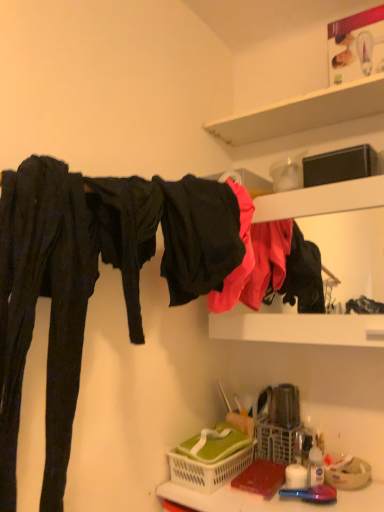
Where is `black matte fabric at upper center`? This screenshot has width=384, height=512. black matte fabric at upper center is located at coordinates (198, 236).

What do you see at coordinates (315, 467) in the screenshot? This screenshot has height=512, width=384. I see `translucent plastic bottle at lower right` at bounding box center [315, 467].

Describe the element at coordinates (293, 329) in the screenshot. Image resolution: width=384 pixels, height=512 pixels. I see `matte black clothing at upper right` at that location.

This screenshot has width=384, height=512. What do you see at coordinates (304, 113) in the screenshot? I see `white matte shelf at upper center` at bounding box center [304, 113].

Measure the distance between white matte shelf at upper center and camera.

white matte shelf at upper center is 3.45 feet away from camera.

Measure the distance between point (193, 504) and camera.

Point (193, 504) and camera are 3.45 feet apart from each other.

Locate an element on the screen. black matte fabric at upper center is located at coordinates (198, 236).

Does point (259, 446) lie behind point (319, 452)?

Yes, point (259, 446) is behind point (319, 452).

Considering the relative positions of white plastic basket at lower center, the first basket in the right-to-left sequence, and translucent plastic bottle at lower right in the image provided, is white plastic basket at lower center, the first basket in the right-to-left sequence, to the left or to the right of translucent plastic bottle at lower right?

Clearly, white plastic basket at lower center, the first basket in the right-to-left sequence, is on the left of translucent plastic bottle at lower right in the image.

Is white plastic basket at lower center, the first basket in the right-to-left sequence, outside of translucent plastic bottle at lower right?

Yes, white plastic basket at lower center, the first basket in the right-to-left sequence, is outside of translucent plastic bottle at lower right.

Can you tell me how much translucent plastic bottle at lower right and translucent plastic basket at lower center differ in facing direction?

The facing directions of translucent plastic bottle at lower right and translucent plastic basket at lower center are 35.4 degrees apart.

Which object is further away from the camera, translucent plastic bottle at lower right or translucent plastic basket at lower center?

translucent plastic bottle at lower right.

Considering the relative positions of translucent plastic bottle at lower right and translucent plastic basket at lower center in the image provided, is translucent plastic bottle at lower right to the right of translucent plastic basket at lower center from the viewer's perspective?

Correct, you'll find translucent plastic bottle at lower right to the right of translucent plastic basket at lower center.

From the picture: Is translucent plastic bottle at lower right oriented towards translucent plastic basket at lower center?

No, translucent plastic bottle at lower right is not aimed at translucent plastic basket at lower center.

From the image's perspective, is white matte shelf at upper center above or below green plastic basket at lower center, positioned as the 1th basket in left-to-right order?

Based on their image positions, white matte shelf at upper center is located above green plastic basket at lower center, positioned as the 1th basket in left-to-right order.

From the picture: Which is more to the left, white matte shelf at upper center or green plastic basket at lower center, the 2th basket positioned from the right?

From the viewer's perspective, green plastic basket at lower center, the 2th basket positioned from the right, appears more on the left side.

From the picture: Looking at their sizes, would you say white matte shelf at upper center is wider or thinner than green plastic basket at lower center, positioned as the 1th basket in left-to-right order?

white matte shelf at upper center is thinner than green plastic basket at lower center, positioned as the 1th basket in left-to-right order.

How different are the orientations of translucent plastic bottle at lower right and white matte shelf at upper center in degrees?

35.4 degrees.

From the image's perspective, is translucent plastic bottle at lower right located above or below white matte shelf at upper center?

From the image's perspective, translucent plastic bottle at lower right appears below white matte shelf at upper center.

Considering the positions of points (310, 480) and (372, 97), is point (310, 480) closer to camera compared to point (372, 97)?

Yes.

Is white matte shelf at upper center further to camera compared to translucent plastic basket at lower center?

Yes, it is behind translucent plastic basket at lower center.

Can you tell me how much white matte shelf at upper center and translucent plastic basket at lower center differ in facing direction?

The facing directions of white matte shelf at upper center and translucent plastic basket at lower center are 0.000712 degrees apart.

Is white matte shelf at upper center bigger or smaller than translucent plastic basket at lower center?

Clearly, white matte shelf at upper center is smaller in size than translucent plastic basket at lower center.

Is translucent plastic bottle at lower right touching green plastic basket at lower center, positioned as the 1th basket in left-to-right order?

They are not placed beside each other.

Which is closer, (321, 476) or (230, 463)?

Clearly, point (321, 476) is closer to the camera than point (230, 463).

From a real-world perspective, is translucent plastic bottle at lower right positioned under green plastic basket at lower center, the 2th basket positioned from the right, based on gravity?

Incorrect, from a real-world perspective, translucent plastic bottle at lower right is higher than green plastic basket at lower center, the 2th basket positioned from the right.

Is translucent plastic bottle at lower right oriented away from green plastic basket at lower center, the 2th basket positioned from the right?

translucent plastic bottle at lower right does not have its back to green plastic basket at lower center, the 2th basket positioned from the right.

Which of these two, matte black clothing at upper right or translucent plastic bottle at lower right, is thinner?

With smaller width is translucent plastic bottle at lower right.

Considering the sizes of objects matte black clothing at upper right and translucent plastic bottle at lower right in the image provided, who is smaller, matte black clothing at upper right or translucent plastic bottle at lower right?

Smaller between the two is translucent plastic bottle at lower right.

Would you say matte black clothing at upper right is inside or outside translucent plastic bottle at lower right?

matte black clothing at upper right is spatially situated outside translucent plastic bottle at lower right.

From a real-world perspective, is matte black clothing at upper right located beneath translucent plastic bottle at lower right?

No, from a real-world perspective, matte black clothing at upper right is not beneath translucent plastic bottle at lower right.

Find the location of `toiletry below the white plastic basket at lower center, the second basket when ordered from left to right (from the image's perspective)`. toiletry below the white plastic basket at lower center, the second basket when ordered from left to right (from the image's perspective) is located at coordinates (315, 467).

Find the location of a particular element. The width and height of the screenshot is (384, 512). counter top that is under the translucent plastic bottle at lower right (from a real-world perspective) is located at coordinates (268, 500).

Considering their positions, is green plastic basket at lower center, positioned as the 1th basket in left-to-right order, positioned closer to translucent plastic bottle at lower right than white matte shelf at upper center?

Based on the image, green plastic basket at lower center, positioned as the 1th basket in left-to-right order, appears to be nearer to translucent plastic bottle at lower right.

Considering their positions, is white matte shelf at upper center positioned closer to matte black clothing at upper right than white plastic basket at lower center, the second basket when ordered from left to right?

Among the two, white plastic basket at lower center, the second basket when ordered from left to right, is located nearer to matte black clothing at upper right.

Looking at the image, which one is located further to green plastic basket at lower center, the 2th basket positioned from the right, matte black clothing at upper right or black matte fabric at upper center?

black matte fabric at upper center is positioned further to the anchor green plastic basket at lower center, the 2th basket positioned from the right.

When comparing their distances from matte black clothing at upper right, does translucent plastic bottle at lower right or white plastic basket at lower center, the first basket in the right-to-left sequence, seem further?

Based on the image, translucent plastic bottle at lower right appears to be further to matte black clothing at upper right.

When comparing their distances from matte black clothing at upper right, does translucent plastic bottle at lower right or white matte shelf at upper center seem closer?

Among the two, translucent plastic bottle at lower right is located nearer to matte black clothing at upper right.

From the image, which object appears to be nearer to translucent plastic basket at lower center, black matte fabric at upper center or white matte shelf at upper center?

black matte fabric at upper center is positioned closer to the anchor translucent plastic basket at lower center.

Considering their positions, is white plastic basket at lower center, the first basket in the right-to-left sequence, positioned closer to white matte shelf at upper center than translucent plastic bottle at lower right?

white plastic basket at lower center, the first basket in the right-to-left sequence.

Estimate the real-world distances between objects in this image. Which object is further from black matte fabric at upper center, translucent plastic basket at lower center or white plastic basket at lower center, the second basket when ordered from left to right?

Based on the image, white plastic basket at lower center, the second basket when ordered from left to right, appears to be further to black matte fabric at upper center.

The width and height of the screenshot is (384, 512). In order to click on basket that lies between black matte fabric at upper center and translucent plastic bottle at lower right from top to bottom in this screenshot , I will do `click(282, 442)`.

Where is `toiletry that lies between white matte shelf at upper center and translucent plastic basket at lower center from top to bottom`? This screenshot has width=384, height=512. toiletry that lies between white matte shelf at upper center and translucent plastic basket at lower center from top to bottom is located at coordinates (315, 467).

In order to click on basket between matte black clothing at upper right and green plastic basket at lower center, the 2th basket positioned from the right, in the vertical direction in this screenshot , I will do `click(282, 442)`.

At what (x,y) coordinates should I click in order to perform the action: click on basket between matte black clothing at upper right and translucent plastic bottle at lower right vertically. Please return your answer as a coordinate pair (x, y). Looking at the image, I should click on (282, 442).